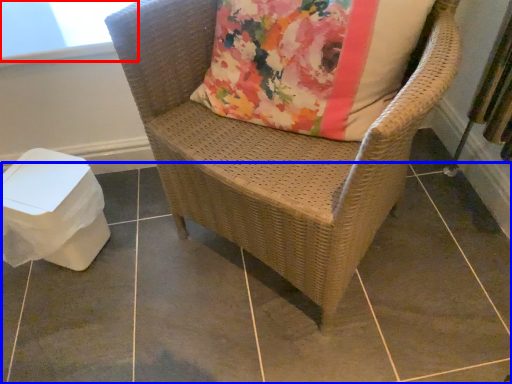
Question: Which point is closer to the camera, window screen (highlighted by a red box) or tile (highlighted by a blue box)?

Choices:
 (A) window screen
 (B) tile

Answer: (B)